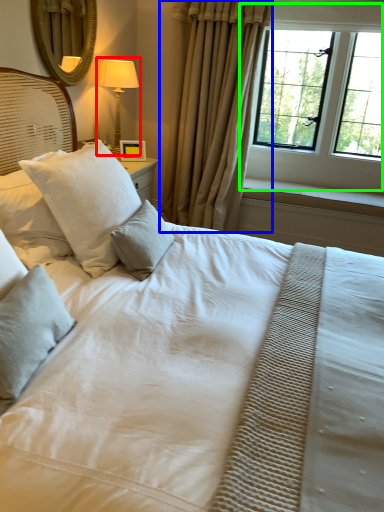
Question: Considering the real-world distances, which object is farthest from bedside lamp (highlighted by a red box)? curtain (highlighted by a blue box) or window (highlighted by a green box)?

Choices:
 (A) curtain
 (B) window

Answer: (B)